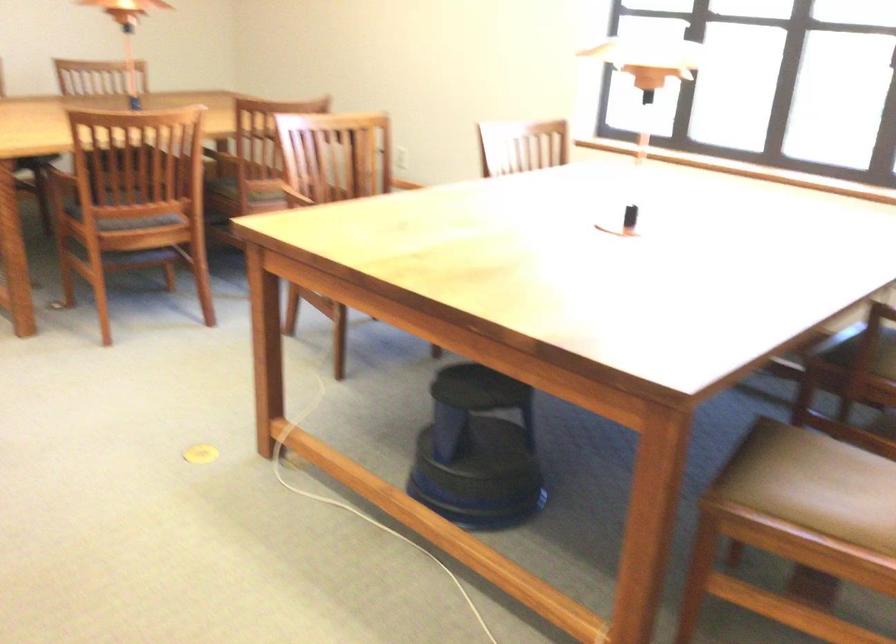
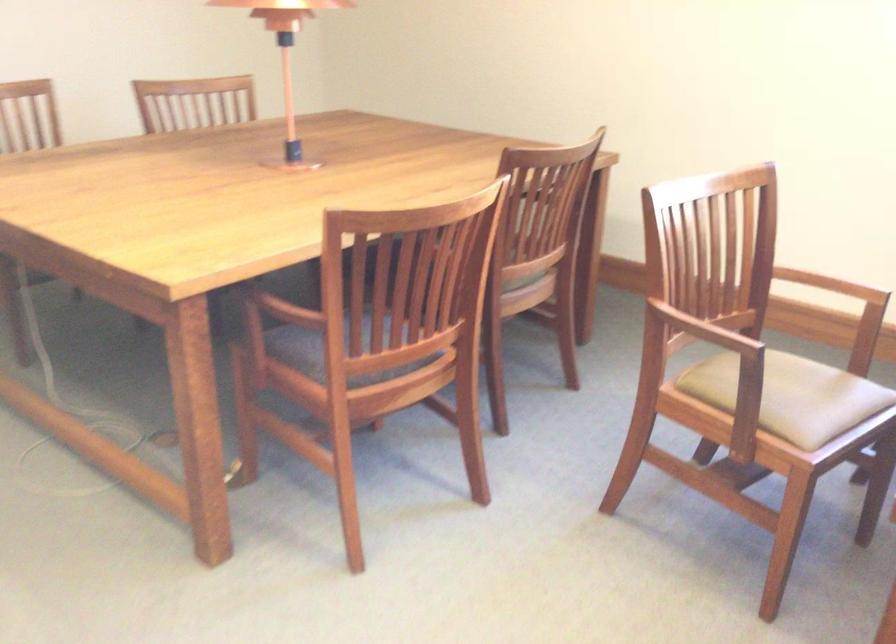
Question: I am providing you with two images of the same scene from different viewpoints. After the viewpoint changes to image2, which objects are now occluded?

Choices:
 (A) brown chair armrest
 (B) grey chair sitting surface
 (C) beige chair sitting surface
 (D) Reese's Puffs box

Answer: (A)